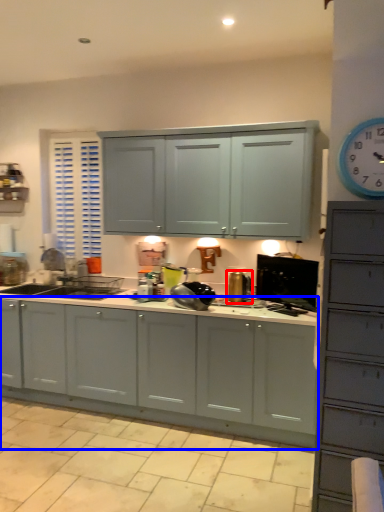
Question: Which object is closer to the camera taking this photo, appliance (highlighted by a red box) or cabinetry (highlighted by a blue box)?

Choices:
 (A) appliance
 (B) cabinetry

Answer: (B)